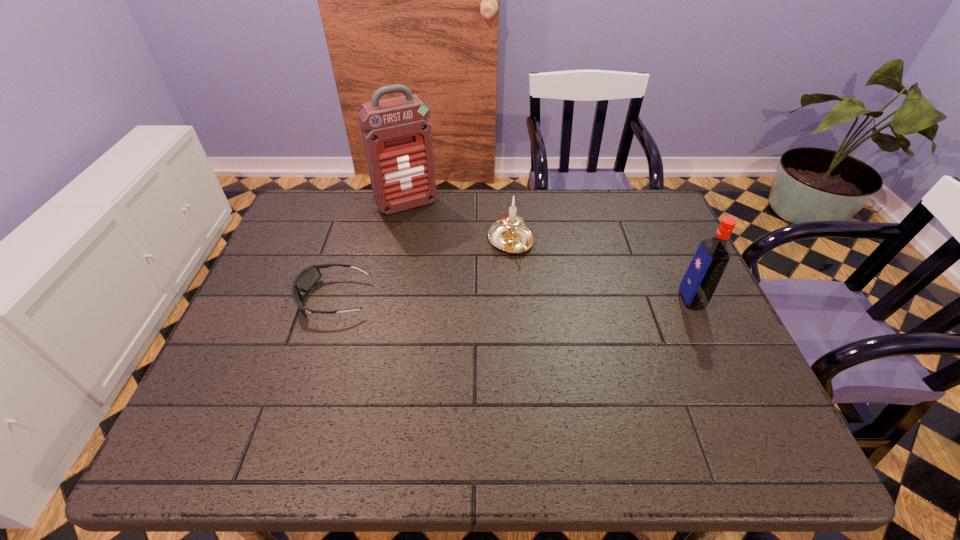
Identify the location of free spot on the desktop that is between the goggles and the rightmost object and is positioned on the front-facing side of the tallest object. pyautogui.click(x=464, y=299).

Identify the location of vacant space on the desktop that is between the shortest object and the rightmost object and is positioned on the handle side of the second farthest object. This screenshot has width=960, height=540. (549, 299).